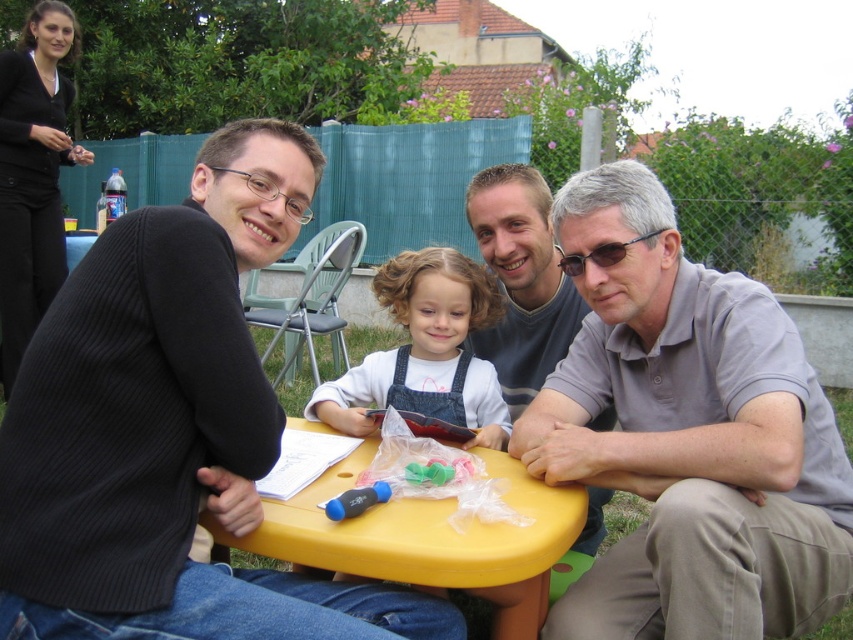
Which is above, black ribbed sweater at upper left or gray cotton shirt at center?

black ribbed sweater at upper left is above.

Can you confirm if black ribbed sweater at upper left is positioned below gray cotton shirt at center?

Incorrect, black ribbed sweater at upper left is not positioned below gray cotton shirt at center.

Does point (276, 248) lie in front of point (663, 483)?

No, (276, 248) is behind (663, 483).

Where is `black ribbed sweater at upper left`? This screenshot has width=853, height=640. black ribbed sweater at upper left is located at coordinates (169, 428).

Does gray cotton shirt at center have a smaller size compared to yellow plastic table at center?

Incorrect, gray cotton shirt at center is not smaller in size than yellow plastic table at center.

Does gray cotton shirt at center have a greater height compared to yellow plastic table at center?

Yes.

Locate an element on the screen. gray cotton shirt at center is located at coordinates (688, 435).

Does black ribbed sweater at upper left have a greater height compared to gray cotton shirt at upper center?

Yes.

Between point (233, 508) and point (537, 314), which one is positioned behind?

The point (537, 314) is behind.

Where is `black ribbed sweater at upper left`? black ribbed sweater at upper left is located at coordinates (169, 428).

Where is `black ribbed sweater at upper left`? black ribbed sweater at upper left is located at coordinates (169, 428).